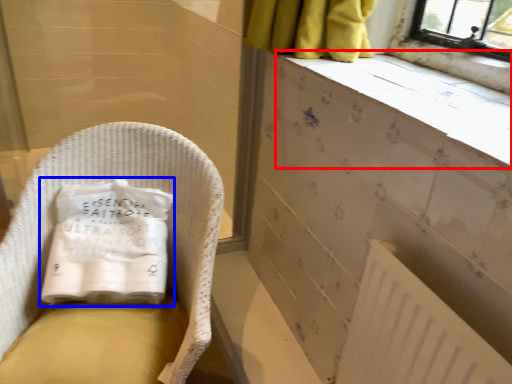
Question: Which of the following is the farthest to the observer, ledge (highlighted by a red box) or material (highlighted by a blue box)?

Choices:
 (A) ledge
 (B) material

Answer: (B)